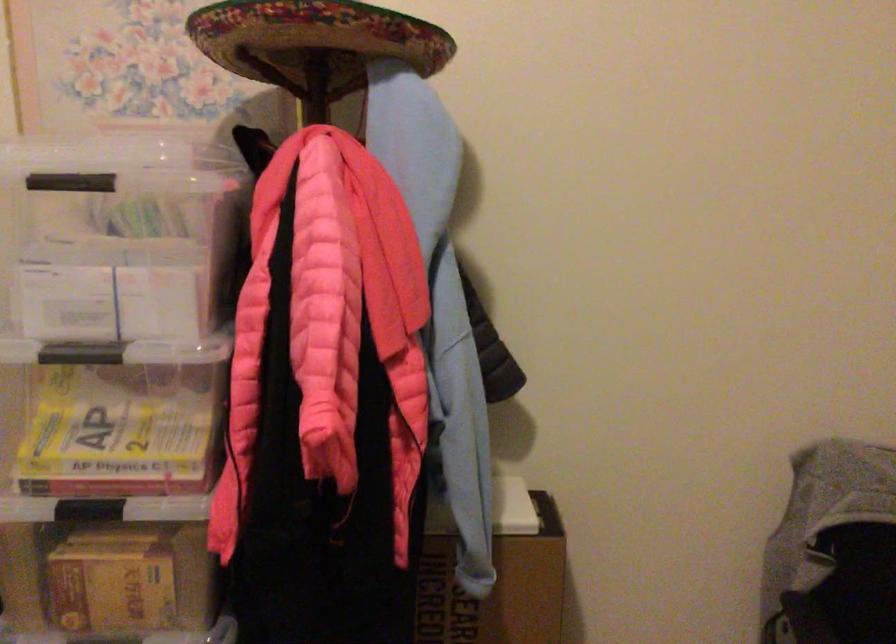
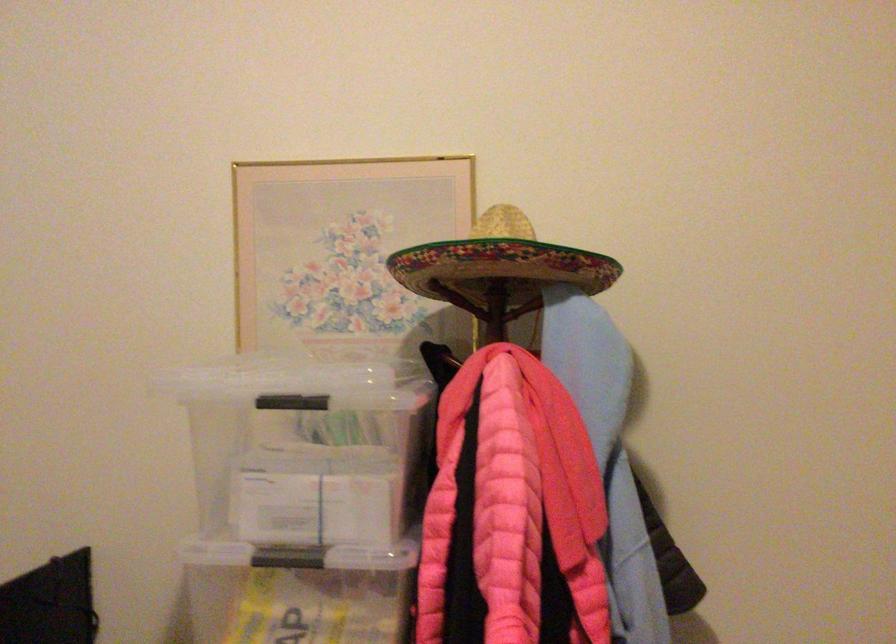
Find the pixel in the second image that matches [73,178] in the first image.

(291, 402)